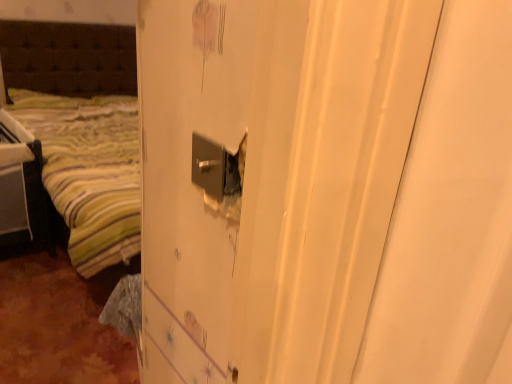
Question: Should I look upward or downward to see satin silver lock at center?

Choices:
 (A) down
 (B) up

Answer: (B)